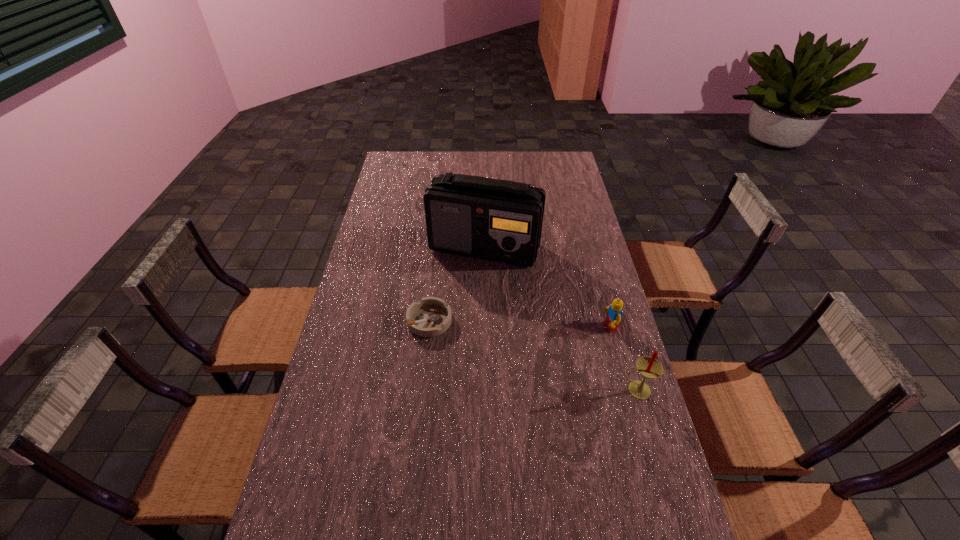
This screenshot has height=540, width=960. I want to click on vacant space on the desktop that is between the ashtray and the third shortest object and is positioned on the front-facing side of the second shortest object, so click(x=499, y=344).

At what (x,y) coordinates should I click in order to perform the action: click on vacant space on the desktop that is between the ashtray and the candle and is positioned on the front panel of the radio receiver. Please return your answer as a coordinate pair (x, y). The width and height of the screenshot is (960, 540). Looking at the image, I should click on (528, 354).